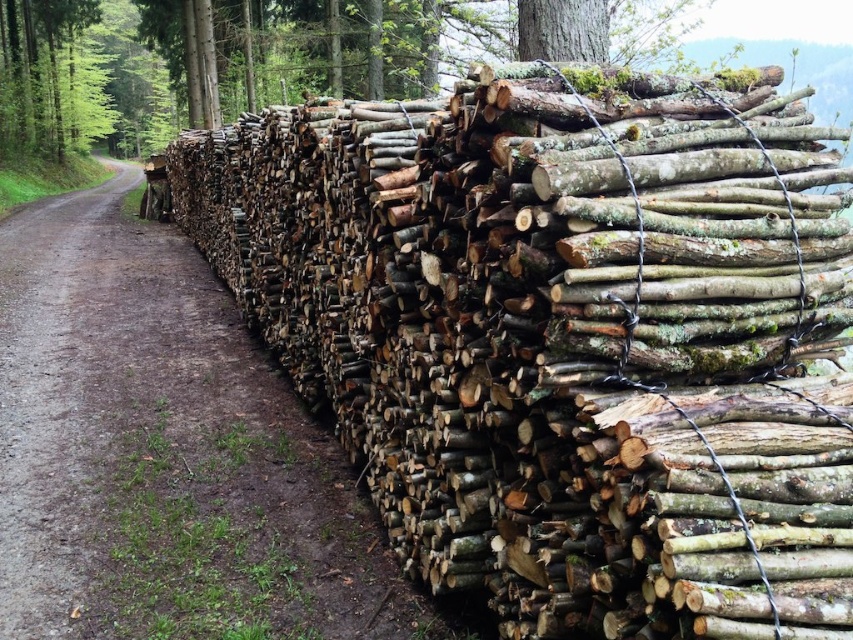
In the scene shown: You are a forest ranger inspecting the logs along the dirt road. You notice the natural wood logs at right and the green mossy bark at upper center. Which object is bigger in size?

The natural wood logs at right has a larger size compared to green mossy bark at upper center.

You are standing in front of the log pile and want to place a marker at the point that is closer to you. Which point should you choose between point (x=393, y=378) and point (x=567, y=32)?

Point (x=393, y=378) is closer to the camera than point (x=567, y=32), so you should choose point (x=393, y=378).

You are standing at the base of the logs in the image. There are two points marked on the logs, one at point (759,93) and another at point (207,61). Which point is closer to you?

Point (759,93) is closer to the viewer than point (207,61).